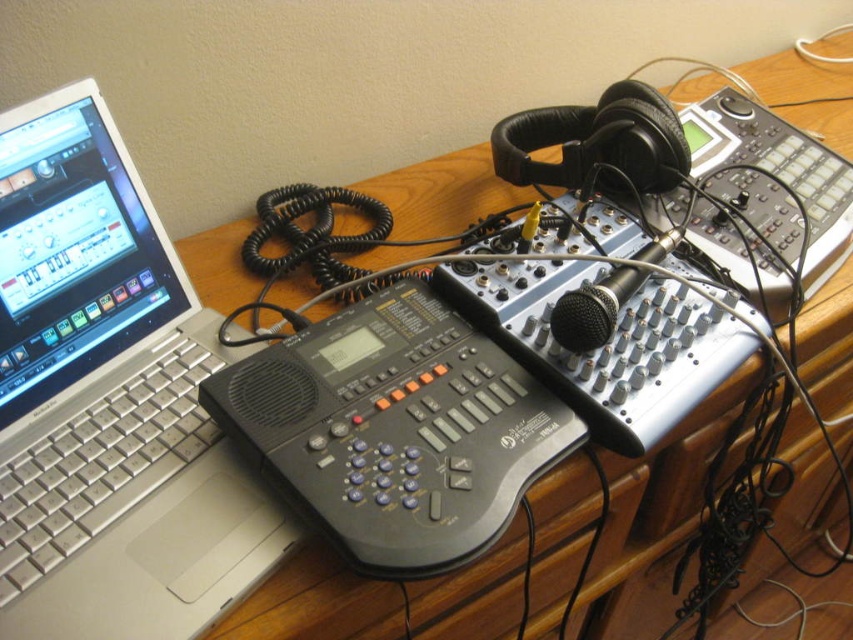
Is silver metallic laptop at left taller than wooden desk at center?

No.

Is point (155, 364) farther from camera compared to point (213, 260)?

No.

Locate an element on the screen. This screenshot has height=640, width=853. silver metallic laptop at left is located at coordinates (109, 401).